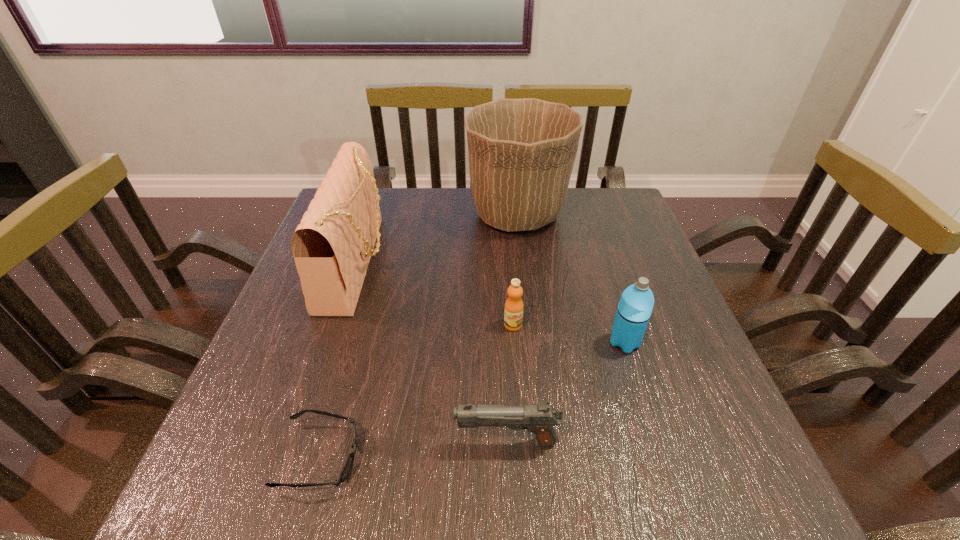
Locate an element on the screen. This screenshot has height=540, width=960. object at the right edge is located at coordinates (635, 307).

Identify the location of object present at the far left corner. (332, 246).

Locate an element on the screen. object present at the near left corner is located at coordinates (348, 465).

Where is `free space at the far edge of the desktop`? Image resolution: width=960 pixels, height=540 pixels. free space at the far edge of the desktop is located at coordinates (464, 191).

Identify the location of vacant space at the near edge of the desktop. (585, 470).

You are a GUI agent. You are given a task and a screenshot of the screen. Output one action in this format:
    pyautogui.click(x=<x>, y=<y>)
    Task: Click on the free space at the left edge
    The image size is (960, 540).
    Given the screenshot: What is the action you would take?
    pyautogui.click(x=320, y=335)

Find the location of a particular element. vacant space at the right edge of the desktop is located at coordinates (643, 235).

This screenshot has width=960, height=540. What are the coordinates of `free space at the near left corner` in the screenshot? It's located at (276, 490).

What are the coordinates of `vacant area at the far right corner of the desktop` in the screenshot? It's located at (581, 213).

In order to click on empty location between the handbag and the flowerpot in this screenshot , I will do `click(437, 238)`.